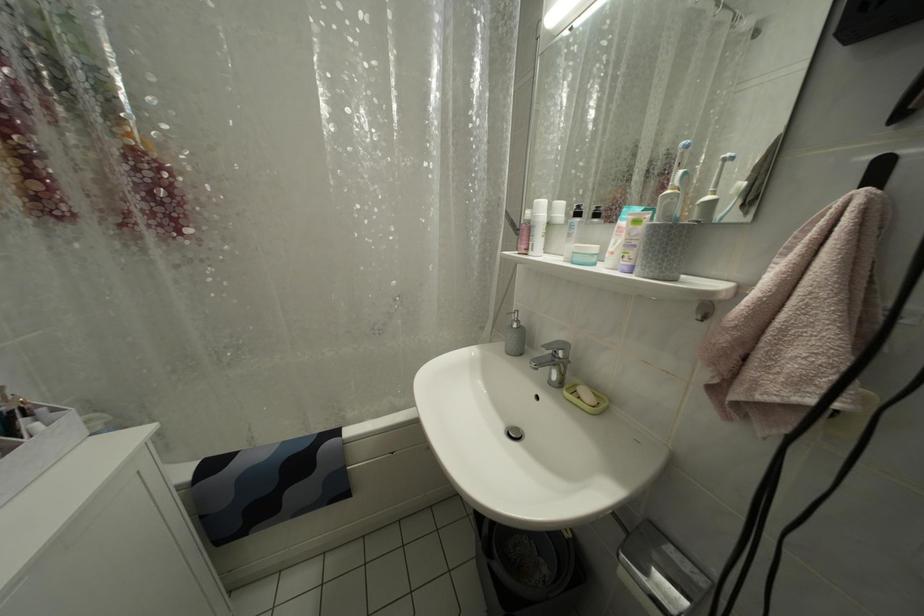
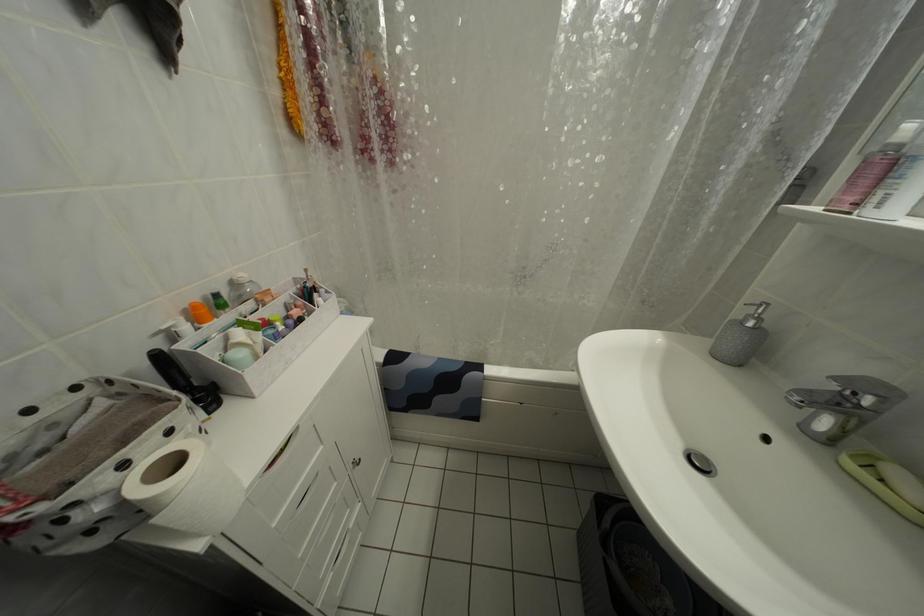
Question: The camera is either moving clockwise (left) or counter-clockwise (right) around the object. The first image is from the beginning of the video and the second image is from the end. Is the camera moving left or right when shooting the video?

Choices:
 (A) Left
 (B) Right

Answer: (B)